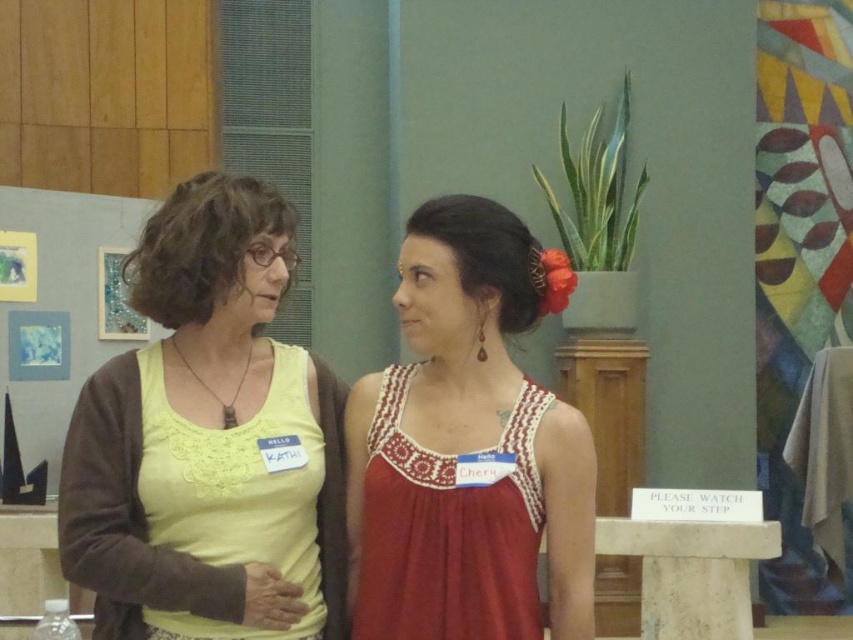
Question: Does matte yellow tank top at center appear over red satin dress at center?

Choices:
 (A) yes
 (B) no

Answer: (A)

Question: Observing the image, what is the correct spatial positioning of matte yellow tank top at center in reference to red satin dress at center?

Choices:
 (A) above
 (B) below

Answer: (A)

Question: Can you confirm if matte yellow tank top at center is positioned to the left of red satin dress at center?

Choices:
 (A) yes
 (B) no

Answer: (A)

Question: Which point is closer to the camera?

Choices:
 (A) red satin dress at center
 (B) matte yellow tank top at center

Answer: (B)

Question: Which point is farther to the camera?

Choices:
 (A) (122, 476)
 (B) (383, 552)

Answer: (B)